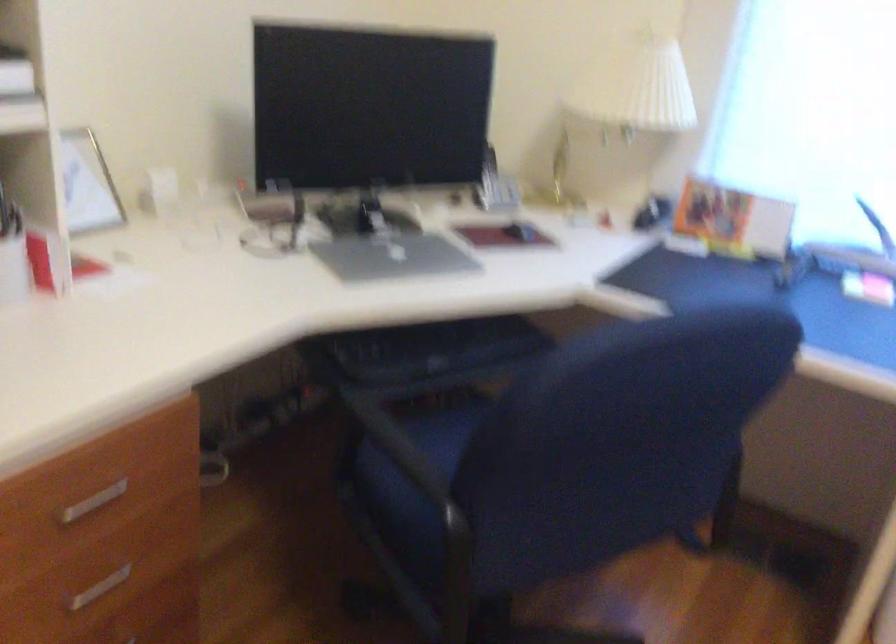
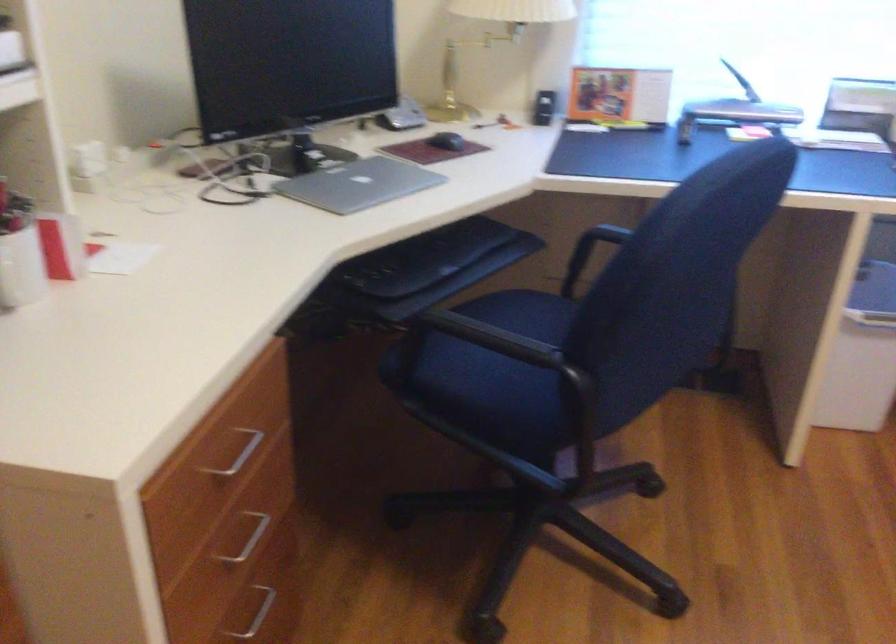
The point at [101,488] is marked in the first image. Where is the corresponding point in the second image?

(238, 453)